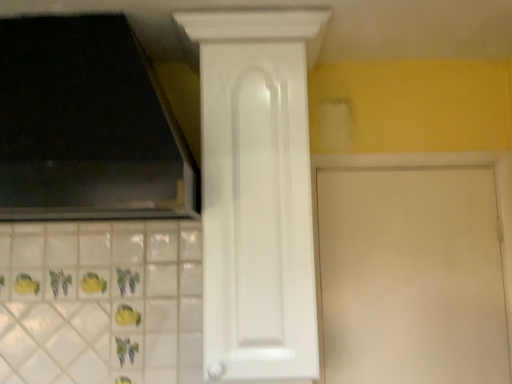
The width and height of the screenshot is (512, 384). In order to click on free point above white matte door at center, positioned as the 2th door in left-to-right order (from a real-world perspective) in this screenshot , I will do `click(403, 165)`.